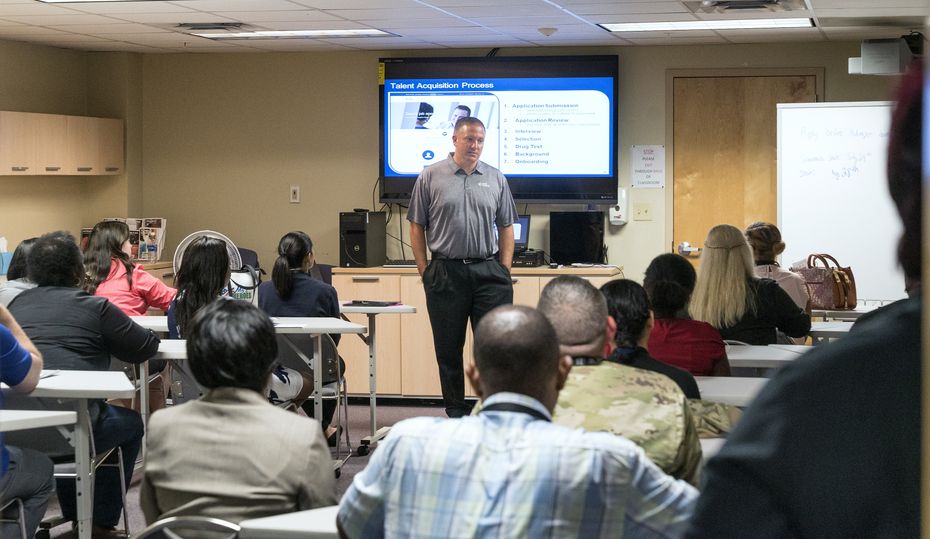
Where is `lightswitch`? Image resolution: width=930 pixels, height=539 pixels. lightswitch is located at coordinates (x=645, y=218).